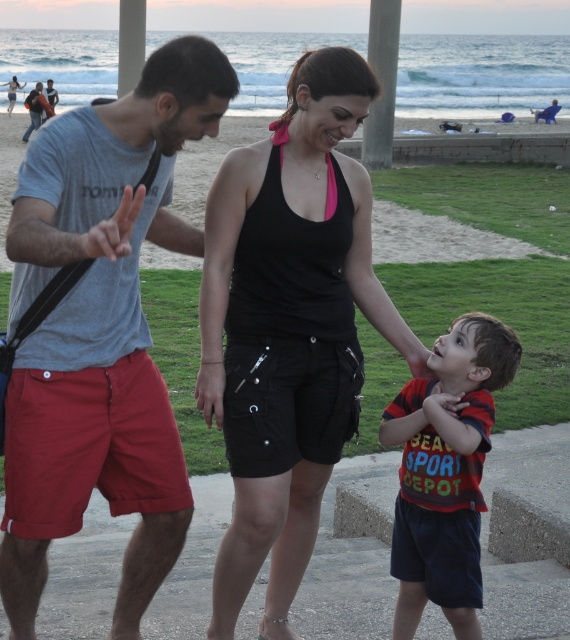
Question: Which point is closer to the camera?

Choices:
 (A) (337, 378)
 (B) (392, 561)
 (C) (92, 289)

Answer: (C)

Question: Can you confirm if matte gray t-shirt at left is positioned above gray concrete pavement at lower center?

Choices:
 (A) yes
 (B) no

Answer: (A)

Question: Which object appears closest to the camera in this image?

Choices:
 (A) black cotton tank top at center
 (B) gray concrete pavement at lower center

Answer: (A)

Question: Is matte gray t-shirt at left positioned in front of black cotton tank top at center?

Choices:
 (A) yes
 (B) no

Answer: (A)

Question: Does matte gray t-shirt at left have a lesser width compared to black cotton tank top at center?

Choices:
 (A) yes
 (B) no

Answer: (A)

Question: Estimate the real-world distances between objects in this image. Which object is farther from the black cotton tank top at center?

Choices:
 (A) striped cotton shirt at center
 (B) matte gray t-shirt at left
 (C) gray concrete pavement at lower center

Answer: (C)